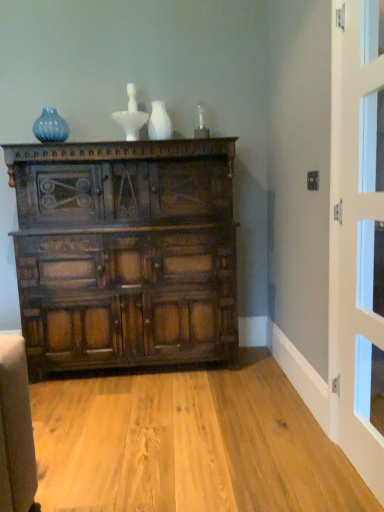
This screenshot has width=384, height=512. What do you see at coordinates (125, 253) in the screenshot?
I see `dark brown wood chest of drawers at center` at bounding box center [125, 253].

Identify the location of white glossy vase at upper center, the first vase positioned from the front. (159, 122).

The height and width of the screenshot is (512, 384). Identify the location of white glossy door at right. (360, 234).

Describe the element at coordinates (50, 127) in the screenshot. The width and height of the screenshot is (384, 512). I see `matte blue glass vase at upper left, placed as the 1th vase when sorted from left to right` at that location.

The height and width of the screenshot is (512, 384). Identify the location of dark brown wood chest of drawers at center. (125, 253).

Is white glossy vase at upper center, the first vase positioned from the front, smaller than dark brown wood chest of drawers at center?

Correct, white glossy vase at upper center, the first vase positioned from the front, occupies less space than dark brown wood chest of drawers at center.

From a real-world perspective, does white glossy vase at upper center, the first vase positioned from the right, sit lower than dark brown wood chest of drawers at center?

Incorrect, from a real-world perspective, white glossy vase at upper center, the first vase positioned from the right, is higher than dark brown wood chest of drawers at center.

From the image's perspective, does white glossy vase at upper center, positioned as the 2th vase in back-to-front order, appear lower than dark brown wood chest of drawers at center?

Actually, white glossy vase at upper center, positioned as the 2th vase in back-to-front order, appears above dark brown wood chest of drawers at center in the image.

Is point (153, 131) closer to viewer compared to point (101, 255)?

No, (153, 131) is further to viewer.

Consider the image. From the image's perspective, between white glossy door at right and dark brown wood chest of drawers at center, which one is located above?

white glossy door at right, from the image's perspective.

Which of these two, white glossy door at right or dark brown wood chest of drawers at center, stands shorter?

dark brown wood chest of drawers at center.

Are white glossy door at right and dark brown wood chest of drawers at center located far from each other?

That's right, there is a large distance between white glossy door at right and dark brown wood chest of drawers at center.

Is white glossy door at right looking in the opposite direction of dark brown wood chest of drawers at center?

No, white glossy door at right is not facing away from dark brown wood chest of drawers at center.

Considering the sizes of objects dark brown wood chest of drawers at center and white glossy vase at upper center, positioned as the 2th vase in back-to-front order, in the image provided, who is bigger, dark brown wood chest of drawers at center or white glossy vase at upper center, positioned as the 2th vase in back-to-front order,?

dark brown wood chest of drawers at center.

Is dark brown wood chest of drawers at center aimed at white glossy vase at upper center, the first vase positioned from the front?

No, dark brown wood chest of drawers at center is not facing towards white glossy vase at upper center, the first vase positioned from the front.

Considering their positions, is dark brown wood chest of drawers at center located in front of or behind white glossy vase at upper center, which is the second vase from left to right?

In the image, dark brown wood chest of drawers at center appears in front of white glossy vase at upper center, which is the second vase from left to right.

Which object is positioned more to the left, dark brown wood chest of drawers at center or white glossy vase at upper center, which is the second vase from left to right?

dark brown wood chest of drawers at center.

Is matte blue glass vase at upper left, the second vase viewed from the front, aimed at white glossy door at right?

No, matte blue glass vase at upper left, the second vase viewed from the front, is not turned towards white glossy door at right.

Considering the relative positions of matte blue glass vase at upper left, placed as the 1th vase when sorted from left to right, and white glossy door at right in the image provided, is matte blue glass vase at upper left, placed as the 1th vase when sorted from left to right, behind white glossy door at right?

Yes, matte blue glass vase at upper left, placed as the 1th vase when sorted from left to right, is further from the viewer.

Considering the relative sizes of matte blue glass vase at upper left, marked as the first vase in a back-to-front arrangement, and white glossy door at right in the image provided, is matte blue glass vase at upper left, marked as the first vase in a back-to-front arrangement, taller than white glossy door at right?

No, matte blue glass vase at upper left, marked as the first vase in a back-to-front arrangement, is not taller than white glossy door at right.

Can you confirm if white glossy vase at upper center, the first vase positioned from the front, is smaller than white glossy door at right?

Yes.

Identify the location of vase that is the 1st one when counting backward from the white glossy door at right. This screenshot has width=384, height=512. (159, 122).

From a real-world perspective, which object stands above the other?

white glossy vase at upper center, the first vase positioned from the right, is physically above.

Which is closer, (152, 136) or (332, 167)?

Point (152, 136) appears to be farther away from the viewer than point (332, 167).

Looking at the image, does white glossy door at right seem bigger or smaller compared to matte blue glass vase at upper left, which is the second vase in right-to-left order?

Clearly, white glossy door at right is larger in size than matte blue glass vase at upper left, which is the second vase in right-to-left order.

Is matte blue glass vase at upper left, marked as the first vase in a back-to-front arrangement, at the back of white glossy door at right?

No, matte blue glass vase at upper left, marked as the first vase in a back-to-front arrangement, is not at the back of white glossy door at right.

You are a GUI agent. You are given a task and a screenshot of the screen. Output one action in this format:
    pyautogui.click(x=<x>, y=<y>)
    Task: Click on the door below the matte blue glass vase at upper left, marked as the first vase in a back-to-front arrangement (from a real-world perspective)
    The height and width of the screenshot is (512, 384).
    Given the screenshot: What is the action you would take?
    pyautogui.click(x=360, y=234)

From a real-world perspective, is white glossy door at right beneath matte blue glass vase at upper left, the second vase viewed from the front?

Yes.

Is dark brown wood chest of drawers at center facing towards matte blue glass vase at upper left, which is the second vase in right-to-left order?

No, dark brown wood chest of drawers at center is not oriented towards matte blue glass vase at upper left, which is the second vase in right-to-left order.

Is dark brown wood chest of drawers at center wider than matte blue glass vase at upper left, the second vase viewed from the front?

Indeed, dark brown wood chest of drawers at center has a greater width compared to matte blue glass vase at upper left, the second vase viewed from the front.

From their relative heights in the image, would you say dark brown wood chest of drawers at center is taller or shorter than matte blue glass vase at upper left, placed as the 1th vase when sorted from left to right?

Considering their sizes, dark brown wood chest of drawers at center has more height than matte blue glass vase at upper left, placed as the 1th vase when sorted from left to right.

The height and width of the screenshot is (512, 384). I want to click on the chest of drawers in front of the white glossy vase at upper center, the first vase positioned from the front, so click(125, 253).

You are a GUI agent. You are given a task and a screenshot of the screen. Output one action in this format:
    pyautogui.click(x=<x>, y=<y>)
    Task: Click on the chest of drawers beneath the white glossy door at right (from a real-world perspective)
    This screenshot has width=384, height=512.
    Given the screenshot: What is the action you would take?
    pyautogui.click(x=125, y=253)

From the image, which object appears to be nearer to white glossy door at right, dark brown wood chest of drawers at center or white glossy vase at upper center, which is the second vase from left to right?

dark brown wood chest of drawers at center.

From the image, which object appears to be nearer to white glossy vase at upper center, positioned as the 2th vase in back-to-front order, matte blue glass vase at upper left, the second vase viewed from the front, or white glossy door at right?

matte blue glass vase at upper left, the second vase viewed from the front, lies closer to white glossy vase at upper center, positioned as the 2th vase in back-to-front order, than the other object.

Considering their positions, is white glossy vase at upper center, which is the second vase from left to right, positioned closer to matte blue glass vase at upper left, placed as the 1th vase when sorted from left to right, than white glossy door at right?

white glossy vase at upper center, which is the second vase from left to right, lies closer to matte blue glass vase at upper left, placed as the 1th vase when sorted from left to right, than the other object.

Based on the photo, based on their spatial positions, is white glossy door at right or white glossy vase at upper center, the first vase positioned from the right, closer to matte blue glass vase at upper left, placed as the 1th vase when sorted from left to right?

white glossy vase at upper center, the first vase positioned from the right, lies closer to matte blue glass vase at upper left, placed as the 1th vase when sorted from left to right, than the other object.

Based on their spatial positions, is matte blue glass vase at upper left, placed as the 1th vase when sorted from left to right, or white glossy vase at upper center, the first vase positioned from the front, closer to white glossy door at right?

white glossy vase at upper center, the first vase positioned from the front, lies closer to white glossy door at right than the other object.

Looking at the image, which one is located further to white glossy vase at upper center, which is the second vase from left to right, white glossy door at right or dark brown wood chest of drawers at center?

white glossy door at right is further to white glossy vase at upper center, which is the second vase from left to right.

Considering their positions, is white glossy vase at upper center, positioned as the 2th vase in back-to-front order, positioned further to dark brown wood chest of drawers at center than white glossy door at right?

white glossy door at right.

Looking at the image, which one is located further to white glossy door at right, white glossy vase at upper center, positioned as the 2th vase in back-to-front order, or matte blue glass vase at upper left, which is the second vase in right-to-left order?

matte blue glass vase at upper left, which is the second vase in right-to-left order.

Find the location of a particular element. vase that lies between matte blue glass vase at upper left, which is the second vase in right-to-left order, and dark brown wood chest of drawers at center from top to bottom is located at coordinates (159, 122).

The width and height of the screenshot is (384, 512). Identify the location of the chest of drawers located between white glossy door at right and white glossy vase at upper center, positioned as the 2th vase in back-to-front order, in the depth direction. (125, 253).

Where is `the chest of drawers located between matte blue glass vase at upper left, placed as the 1th vase when sorted from left to right, and white glossy door at right in the left-right direction`? the chest of drawers located between matte blue glass vase at upper left, placed as the 1th vase when sorted from left to right, and white glossy door at right in the left-right direction is located at coordinates (125, 253).

At what (x,y) coordinates should I click in order to perform the action: click on vase positioned between white glossy door at right and matte blue glass vase at upper left, placed as the 1th vase when sorted from left to right, from near to far. Please return your answer as a coordinate pair (x, y). The height and width of the screenshot is (512, 384). Looking at the image, I should click on (159, 122).